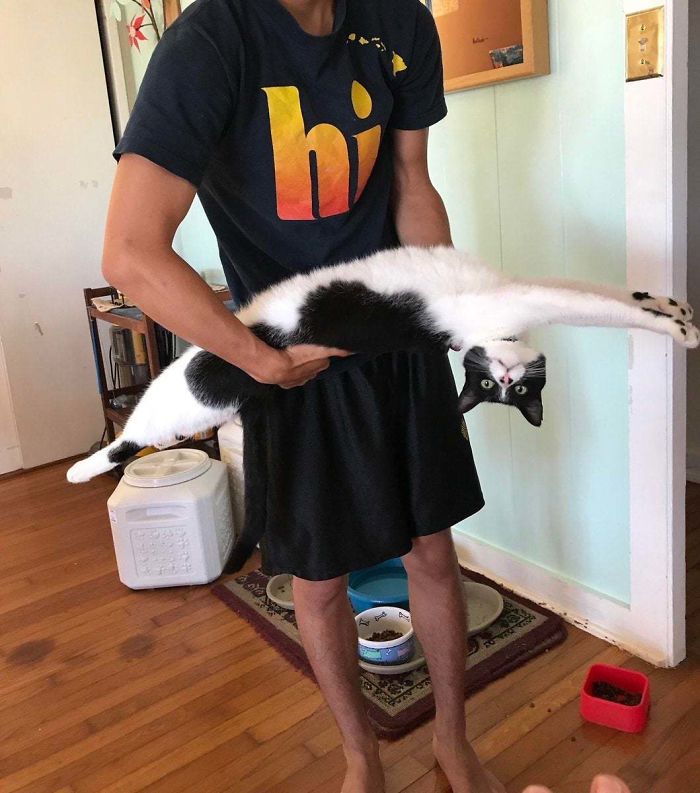
At what (x,y) coordinates should I click in order to perform the action: click on shelf. Please return your answer as a coordinate pair (x, y). The height and width of the screenshot is (793, 700). Looking at the image, I should click on (129, 358).